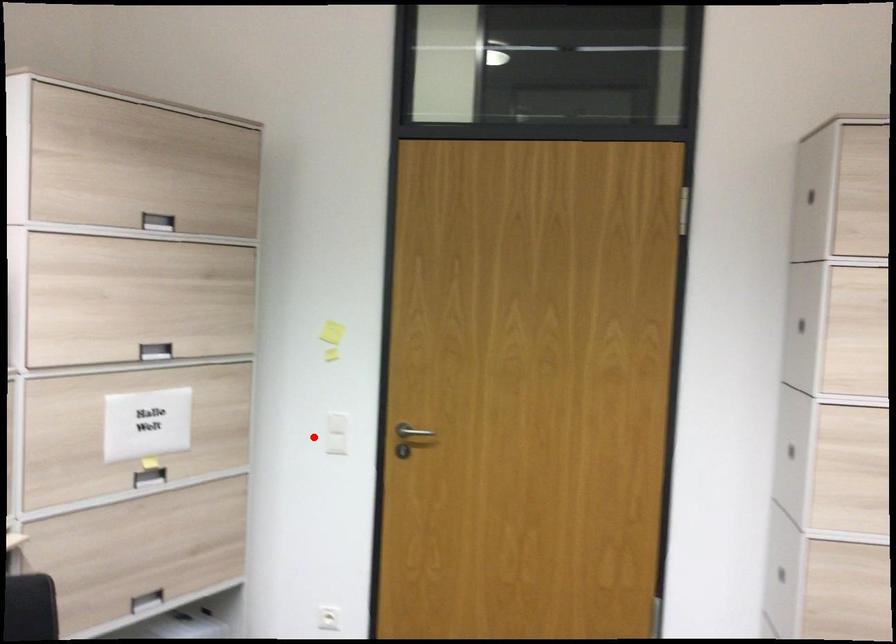
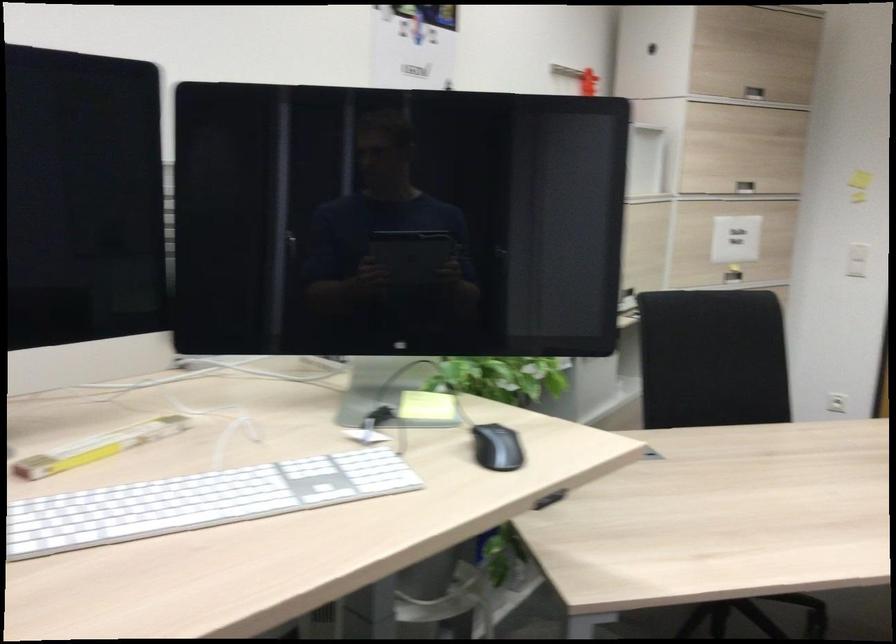
Question: A red point is marked in image1. In image2, is the corresponding 3D point closer to the camera or farther? Reply with the corresponding letter.

Choices:
 (A) The corresponding 3D point is closer.
 (B) The corresponding 3D point is farther.

Answer: (B)